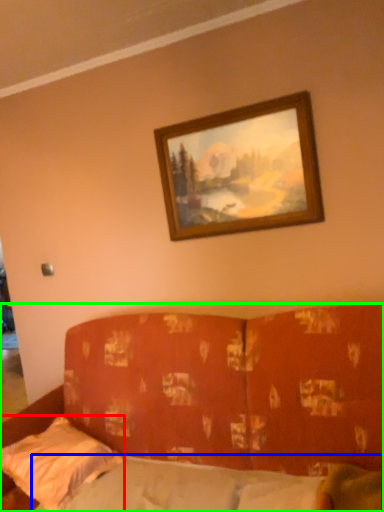
Question: Which object is the farthest from pillow (highlighted by a red box)? Choose among these: mattress (highlighted by a blue box) or studio couch (highlighted by a green box).

Choices:
 (A) mattress
 (B) studio couch

Answer: (B)